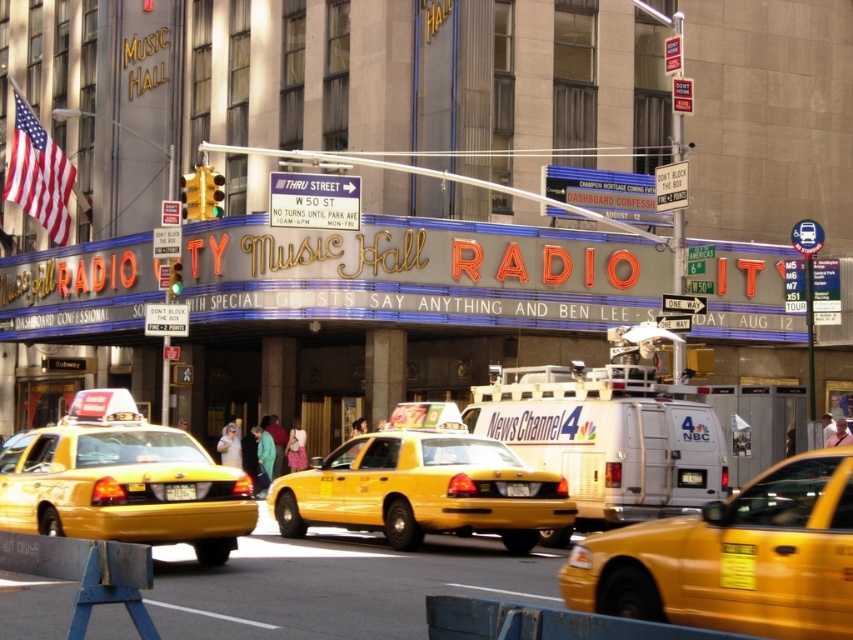
Between point (699, 618) and point (608, 362), which one is positioned in front?

Positioned in front is point (699, 618).

Between yellow rubber taxi at center and white metallic van at center, which one is positioned lower?

white metallic van at center

What do you see at coordinates (734, 557) in the screenshot? I see `yellow rubber taxi at center` at bounding box center [734, 557].

Image resolution: width=853 pixels, height=640 pixels. What are the coordinates of `yellow rubber taxi at center` in the screenshot? It's located at (734, 557).

Does white metallic van at center have a greater width compared to yellow plastic taxi at center?

In fact, white metallic van at center might be narrower than yellow plastic taxi at center.

Does point (641, 396) come in front of point (403, 513)?

No, it is behind (403, 513).

Image resolution: width=853 pixels, height=640 pixels. I want to click on white metallic van at center, so click(x=608, y=429).

Can you confirm if white metallic van at center is wider than yellow plastic taxi cab at center?

Correct, the width of white metallic van at center exceeds that of yellow plastic taxi cab at center.

What do you see at coordinates (608, 429) in the screenshot?
I see `white metallic van at center` at bounding box center [608, 429].

Where is `white metallic van at center`? white metallic van at center is located at coordinates (608, 429).